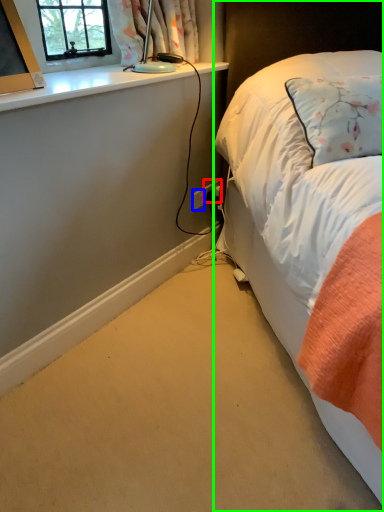
Question: Which object is the farthest from power plugs and sockets (highlighted by a red box)? Choose among these: power plugs and sockets (highlighted by a blue box) or bed (highlighted by a green box).

Choices:
 (A) power plugs and sockets
 (B) bed

Answer: (B)